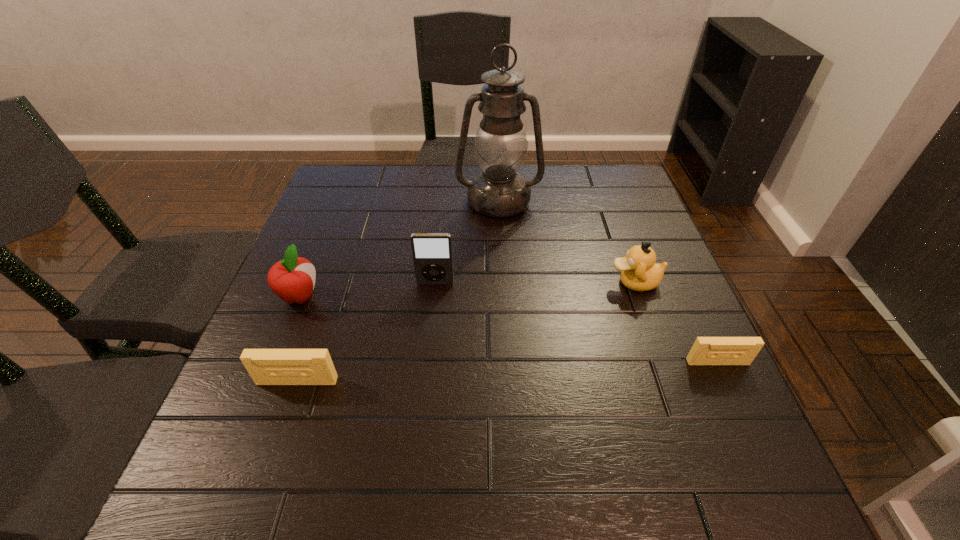
I want to click on free space between the taller videotape and the apple, so click(299, 339).

Locate an element on the screen. The height and width of the screenshot is (540, 960). free space between the tallest object and the apple is located at coordinates (399, 249).

At what (x,y) coordinates should I click in order to perform the action: click on vacant area that lies between the apple and the shortest object. Please return your answer as a coordinate pair (x, y). The height and width of the screenshot is (540, 960). Looking at the image, I should click on (509, 329).

I want to click on free point between the apple and the iPod, so click(x=368, y=290).

The image size is (960, 540). I want to click on free area in between the apple and the second shortest object, so click(299, 339).

Locate an element on the screen. The height and width of the screenshot is (540, 960). free space between the duckling and the oil lamp is located at coordinates (566, 242).

At what (x,y) coordinates should I click in order to perform the action: click on free space between the fifth tallest object and the duckling. Please return your answer as a coordinate pair (x, y). This screenshot has width=960, height=540. Looking at the image, I should click on (466, 332).

What are the coordinates of `object that stands as the third closest to the apple` in the screenshot? It's located at (501, 144).

Locate which object ranks fourth in proximity to the fifth shortest object. Please provide its 2D coordinates. Your answer should be formatted as a tuple, i.e. [(x, y)], where the tuple contains the x and y coordinates of a point satisfying the conditions above.

[(639, 272)]

In order to click on free spot that satisfies the following two spatial constraints: 1. on the face of the duckling; 2. at the front of the left videotape with spools in this screenshot , I will do tap(670, 381).